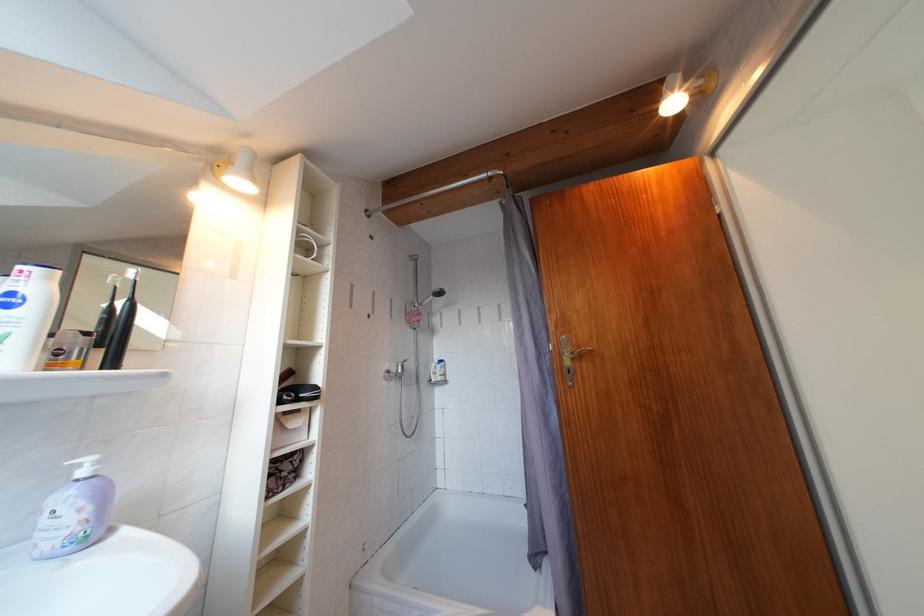
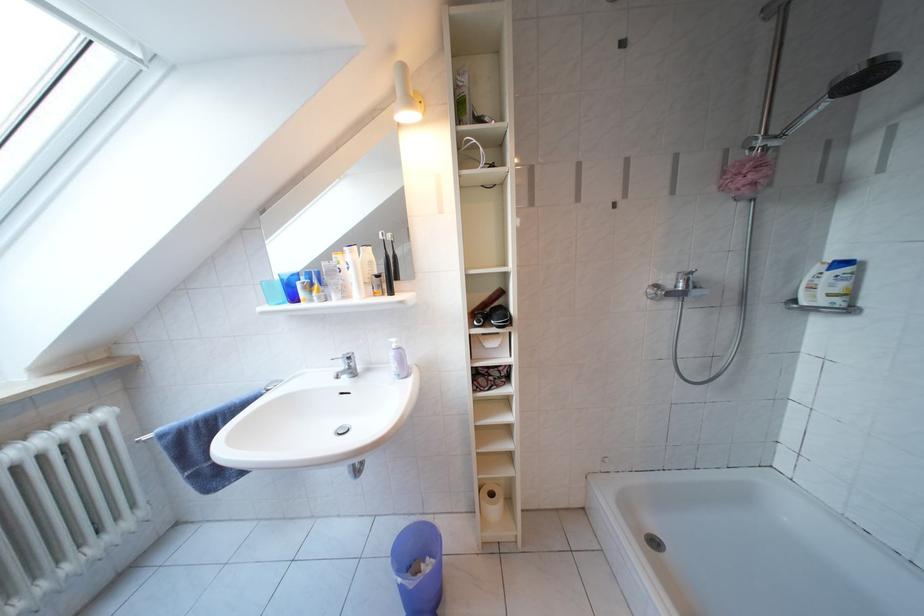
Find the pixel in the second image that matches [448,299] in the first image.

(876, 82)